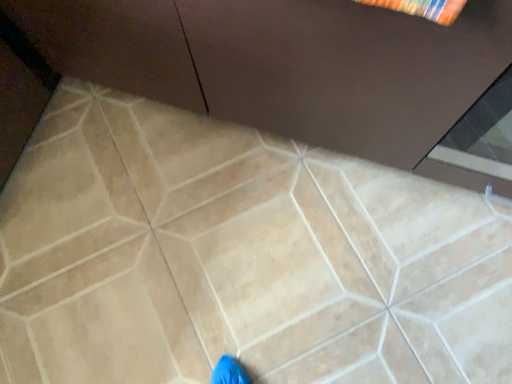
At what (x,y) coordinates should I click in order to perform the action: click on matte brown cabinet at upper center. Please return your answer as a coordinate pair (x, y). Image resolution: width=512 pixels, height=384 pixels. Looking at the image, I should click on (302, 72).

Measure the distance between point [433,152] and camera.

Point [433,152] and camera are 1.05 meters apart.

Measure the distance between matte brown cabinet at upper center and camera.

matte brown cabinet at upper center and camera are 22.74 inches apart from each other.

The height and width of the screenshot is (384, 512). Describe the element at coordinates (302, 72) in the screenshot. I see `matte brown cabinet at upper center` at that location.

Find the location of `matte brown cabinet at upper center`. matte brown cabinet at upper center is located at coordinates (302, 72).